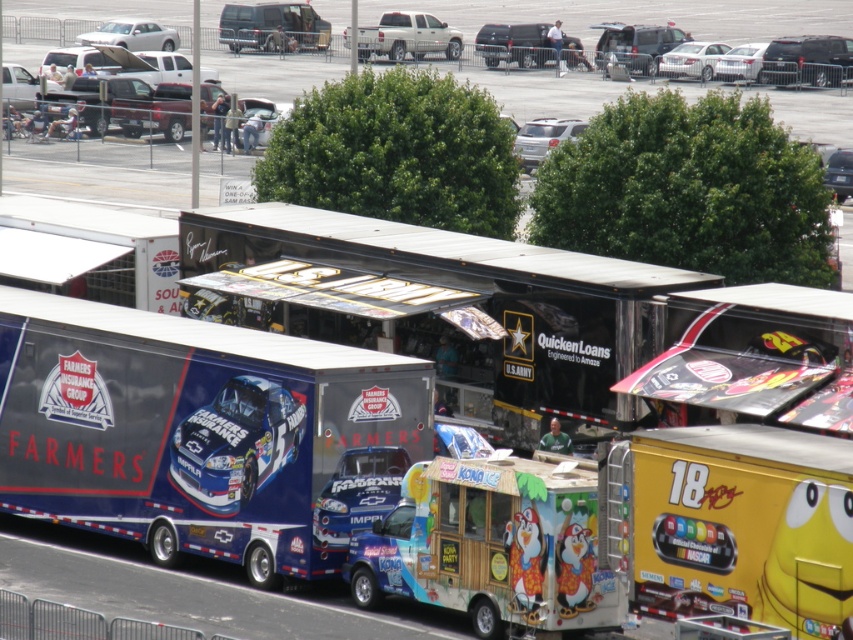
Find the location of `white metallic sedan at upper right`. white metallic sedan at upper right is located at coordinates (753, 65).

Which is more to the right, white metallic sedan at upper right or silver metallic sedan at upper center?

From the viewer's perspective, white metallic sedan at upper right appears more on the right side.

At what (x,y) coordinates should I click in order to perform the action: click on white metallic sedan at upper right. Please return your answer as a coordinate pair (x, y). Looking at the image, I should click on tap(753, 65).

I want to click on white metallic sedan at upper right, so click(x=753, y=65).

Which is more to the right, matte blue food truck at center or silver metallic sedan at upper center?

Positioned to the right is silver metallic sedan at upper center.

Does matte blue food truck at center have a lesser height compared to silver metallic sedan at upper center?

No, matte blue food truck at center is not shorter than silver metallic sedan at upper center.

Who is more distant from viewer, [357,589] or [717,54]?

Positioned behind is point [717,54].

In order to click on matte blue food truck at center in this screenshot , I will do `click(492, 545)`.

Is metallic silver truck at center to the left of metallic silver car at center from the viewer's perspective?

Indeed, metallic silver truck at center is positioned on the left side of metallic silver car at center.

Who is positioned more to the right, metallic silver truck at center or metallic silver car at center?

metallic silver car at center is more to the right.

Who is more distant from viewer, (585, 84) or (828, 157)?

Positioned behind is point (585, 84).

Locate an element on the screen. metallic silver truck at center is located at coordinates (639, 16).